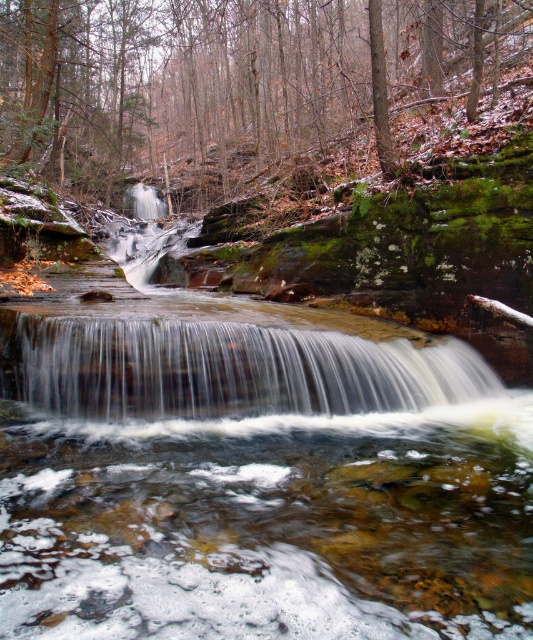
Is green mossy rocks at center thinner than white frothy water at center?

Incorrect, green mossy rocks at center's width is not less than white frothy water at center's.

The width and height of the screenshot is (533, 640). Describe the element at coordinates (179, 88) in the screenshot. I see `green mossy rocks at center` at that location.

The height and width of the screenshot is (640, 533). Find the location of `green mossy rocks at center`. green mossy rocks at center is located at coordinates (179, 88).